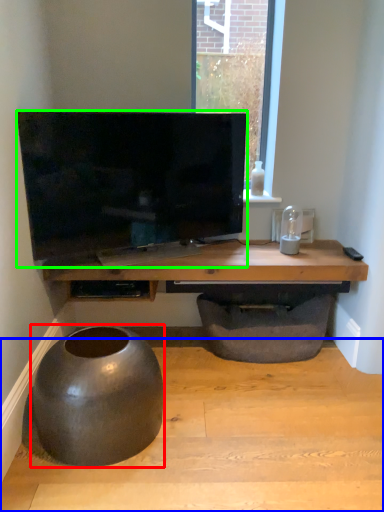
Question: Which is nearer to the round table (highlighted by a red box)? concrete (highlighted by a blue box) or television (highlighted by a green box).

Choices:
 (A) concrete
 (B) television

Answer: (A)